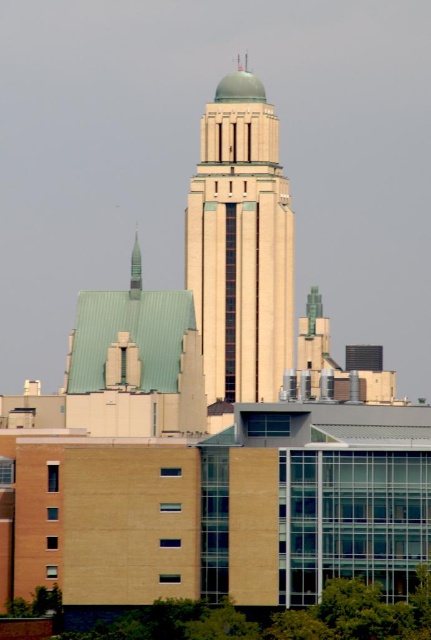
You are an architect analyzing the cityscape. You need to determine which structure is wider between the beige concrete tower at center and the green matte spire at upper center. Based on the scene, which one is wider?

The beige concrete tower at center is wider than the green matte spire at upper center.

Looking at this image, you are standing at the point marked by the coordinate point at point (240, 244). Looking around, you see the beige concrete tower at center. Which direction should you face to see the beige concrete tower at center?

You should face towards the center of the scene because the beige concrete tower at center is located at point (240, 244), which is the center of the image.